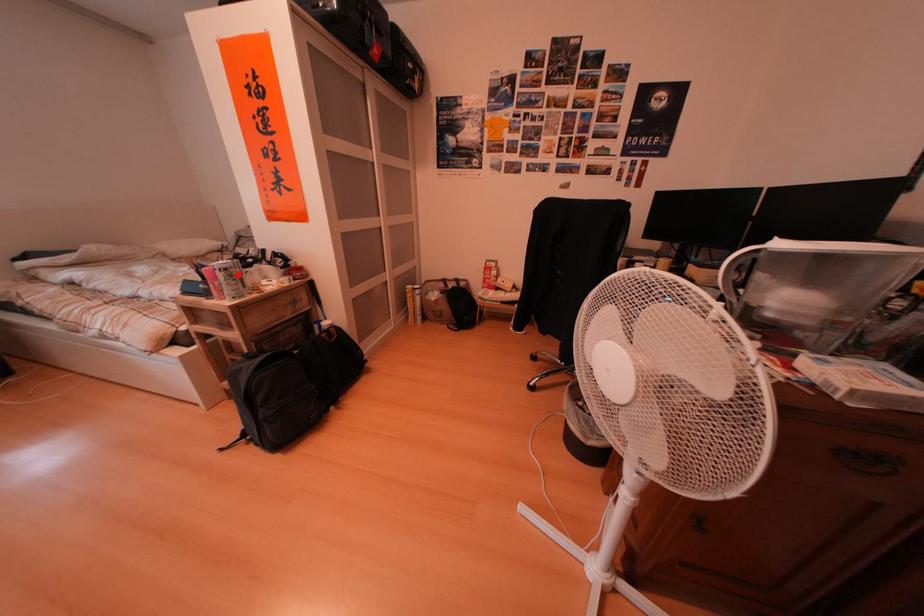
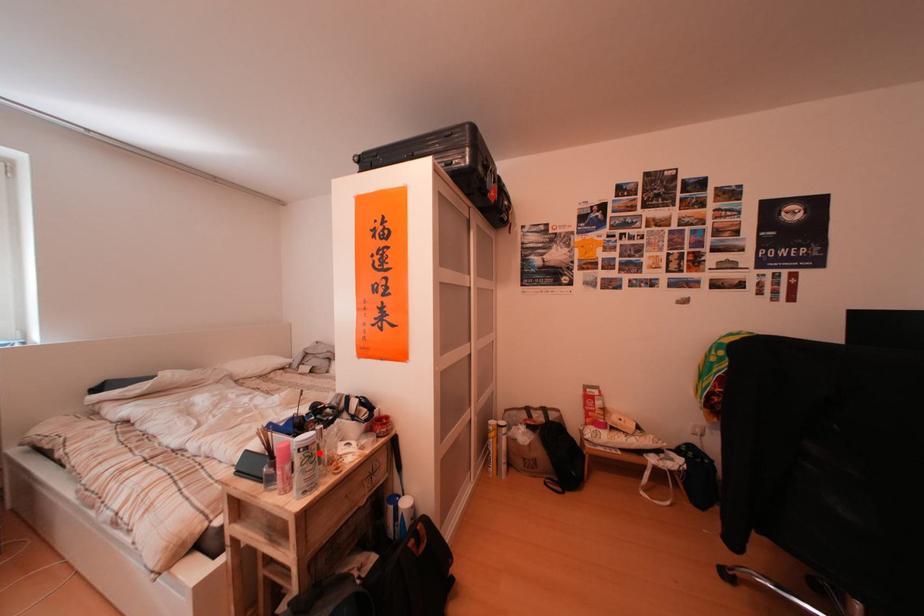
I am providing you with two images of the same scene from different viewpoints. A red point is marked on the first image and another point is marked on the second image. Is the marked point in image1 the same physical position as the marked point in image2?

Yes